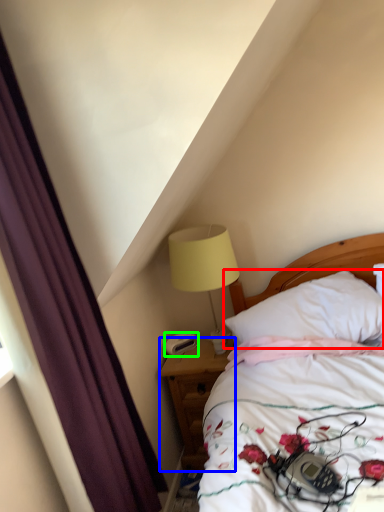
Question: Which object is the farthest from pillow (highlighted by a red box)? Choose among these: nightstand (highlighted by a blue box) or alarm clock (highlighted by a green box).

Choices:
 (A) nightstand
 (B) alarm clock

Answer: (B)